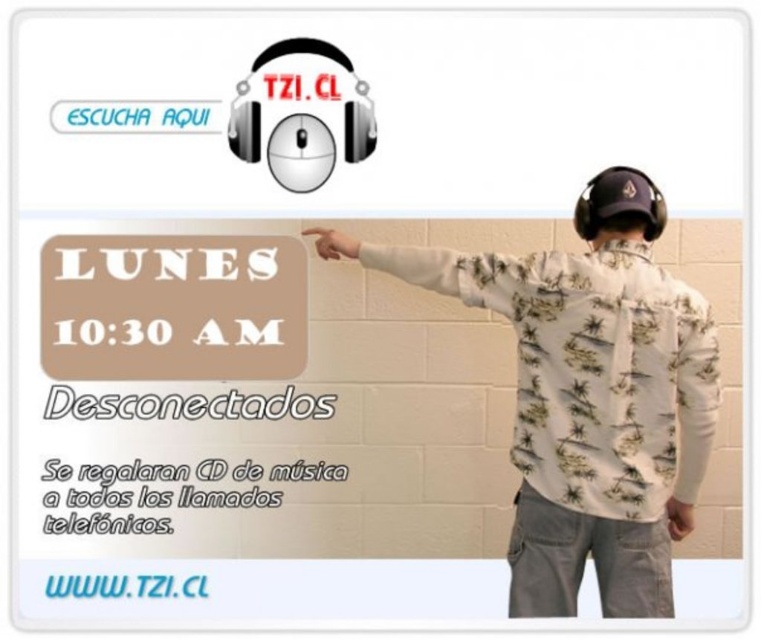
Is light beige skin at upper center smaller than light brown leather hand at lower right?

Actually, light beige skin at upper center might be larger than light brown leather hand at lower right.

Is point (328, 250) farther from camera compared to point (673, 515)?

That is True.

Where is `light beige skin at upper center`? The height and width of the screenshot is (640, 761). light beige skin at upper center is located at coordinates (333, 243).

Is white floral shirt at center above light brown leather hand at lower right?

Correct, white floral shirt at center is located above light brown leather hand at lower right.

Measure the distance between white floral shirt at center and camera.

white floral shirt at center and camera are 6.52 feet apart.

This screenshot has height=640, width=761. What are the coordinates of `white floral shirt at center` in the screenshot? It's located at (594, 396).

Where is `white floral shirt at center`? The width and height of the screenshot is (761, 640). white floral shirt at center is located at coordinates (594, 396).

Can you confirm if white floral shirt at center is positioned below light beige skin at upper center?

Indeed, white floral shirt at center is positioned under light beige skin at upper center.

What do you see at coordinates (594, 396) in the screenshot? I see `white floral shirt at center` at bounding box center [594, 396].

Where is `white floral shirt at center`? white floral shirt at center is located at coordinates (594, 396).